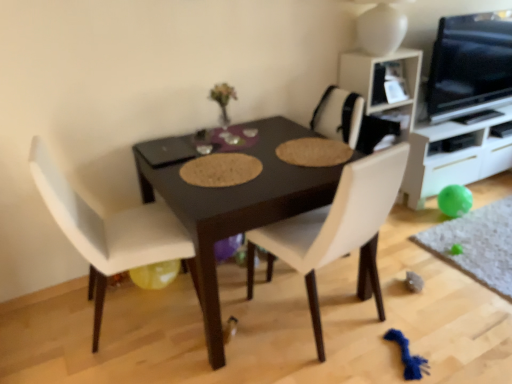
Find the location of `vacant area in front of yellow rubber balloon at lower left`. vacant area in front of yellow rubber balloon at lower left is located at coordinates (152, 309).